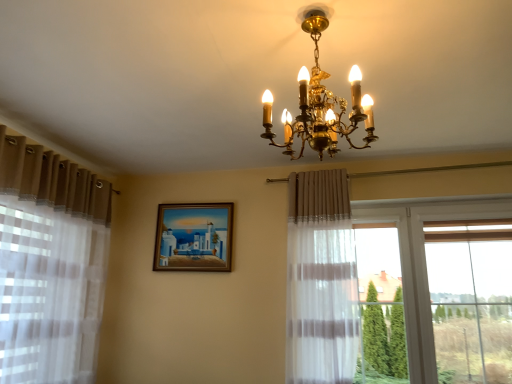
Where is `wooden framed painting at center`? This screenshot has height=384, width=512. wooden framed painting at center is located at coordinates (194, 237).

Describe the element at coordinates (194, 237) in the screenshot. I see `wooden framed painting at center` at that location.

Describe the element at coordinates (320, 102) in the screenshot. The width and height of the screenshot is (512, 384). I see `gold metallic chandelier at upper center` at that location.

I want to click on gold metallic chandelier at upper center, so click(x=320, y=102).

In order to face gold metallic chandelier at upper center, should I rotate leftwards or rightwards?

Turn right by 8.664 degrees to look at gold metallic chandelier at upper center.

Measure the distance between point (343,128) and camera.

Point (343,128) and camera are 5.13 feet apart.

The image size is (512, 384). In order to click on wooden framed painting at center in this screenshot , I will do `click(194, 237)`.

Is wooden framed painting at center to the left of gold metallic chandelier at upper center from the viewer's perspective?

Indeed, wooden framed painting at center is positioned on the left side of gold metallic chandelier at upper center.

Is wooden framed painting at center in front of or behind gold metallic chandelier at upper center in the image?

wooden framed painting at center is positioned farther from the viewer than gold metallic chandelier at upper center.

Does point (161, 205) come behind point (271, 111)?

That is True.

From the image's perspective, which object appears higher, wooden framed painting at center or gold metallic chandelier at upper center?

gold metallic chandelier at upper center appears higher in the image.

From a real-world perspective, is wooden framed painting at center on top of gold metallic chandelier at upper center?

No, from a real-world perspective, wooden framed painting at center is not on top of gold metallic chandelier at upper center.

Can you confirm if wooden framed painting at center is thinner than gold metallic chandelier at upper center?

Yes.

Considering the sizes of wooden framed painting at center and gold metallic chandelier at upper center in the image, is wooden framed painting at center taller or shorter than gold metallic chandelier at upper center?

wooden framed painting at center is shorter than gold metallic chandelier at upper center.

Considering the relative sizes of wooden framed painting at center and gold metallic chandelier at upper center in the image provided, is wooden framed painting at center smaller than gold metallic chandelier at upper center?

Correct, wooden framed painting at center occupies less space than gold metallic chandelier at upper center.

Based on the photo, do you think wooden framed painting at center is within gold metallic chandelier at upper center, or outside of it?

wooden framed painting at center cannot be found inside gold metallic chandelier at upper center.

Is wooden framed painting at center not near gold metallic chandelier at upper center?

Yes.

Based on the photo, is wooden framed painting at center positioned with its back to gold metallic chandelier at upper center?

No, gold metallic chandelier at upper center is not at the back of wooden framed painting at center.

What's the angular difference between wooden framed painting at center and gold metallic chandelier at upper center's facing directions?

wooden framed painting at center and gold metallic chandelier at upper center are facing 90.6 degrees away from each other.

Locate an element on the screen. The height and width of the screenshot is (384, 512). picture frame located behind the gold metallic chandelier at upper center is located at coordinates (194, 237).

Which is more to the right, gold metallic chandelier at upper center or wooden framed painting at center?

From the viewer's perspective, gold metallic chandelier at upper center appears more on the right side.

Does gold metallic chandelier at upper center lie behind wooden framed painting at center?

That is False.

Is point (356, 96) farther from viewer compared to point (199, 219)?

No, (356, 96) is closer to viewer.

From the image's perspective, between gold metallic chandelier at upper center and wooden framed painting at center, which one is located above?

gold metallic chandelier at upper center.

From a real-world perspective, who is located higher, gold metallic chandelier at upper center or wooden framed painting at center?

In real-world perspective, gold metallic chandelier at upper center is above.

Is gold metallic chandelier at upper center wider than wooden framed painting at center?

Indeed, gold metallic chandelier at upper center has a greater width compared to wooden framed painting at center.

Is gold metallic chandelier at upper center taller or shorter than wooden framed painting at center?

Considering their sizes, gold metallic chandelier at upper center has more height than wooden framed painting at center.

Can you confirm if gold metallic chandelier at upper center is bigger than wooden framed painting at center?

Correct, gold metallic chandelier at upper center is larger in size than wooden framed painting at center.

Is wooden framed painting at center surrounded by gold metallic chandelier at upper center?

No.

Would you consider gold metallic chandelier at upper center to be distant from wooden framed painting at center?

Indeed, gold metallic chandelier at upper center is not near wooden framed painting at center.

Is gold metallic chandelier at upper center aimed at wooden framed painting at center?

No, gold metallic chandelier at upper center is not aimed at wooden framed painting at center.

How many degrees apart are the facing directions of gold metallic chandelier at upper center and wooden framed painting at center?

There is a 90.6-degree angle between the facing directions of gold metallic chandelier at upper center and wooden framed painting at center.

How distant is gold metallic chandelier at upper center from wooden framed painting at center?

gold metallic chandelier at upper center and wooden framed painting at center are 2.10 meters apart.

Identify the location of lamp that is above the wooden framed painting at center (from the image's perspective). The width and height of the screenshot is (512, 384). (320, 102).

The width and height of the screenshot is (512, 384). What are the coordinates of `picture frame directly beneath the gold metallic chandelier at upper center (from a real-world perspective)` in the screenshot? It's located at (194, 237).

The image size is (512, 384). I want to click on picture frame behind the gold metallic chandelier at upper center, so click(x=194, y=237).